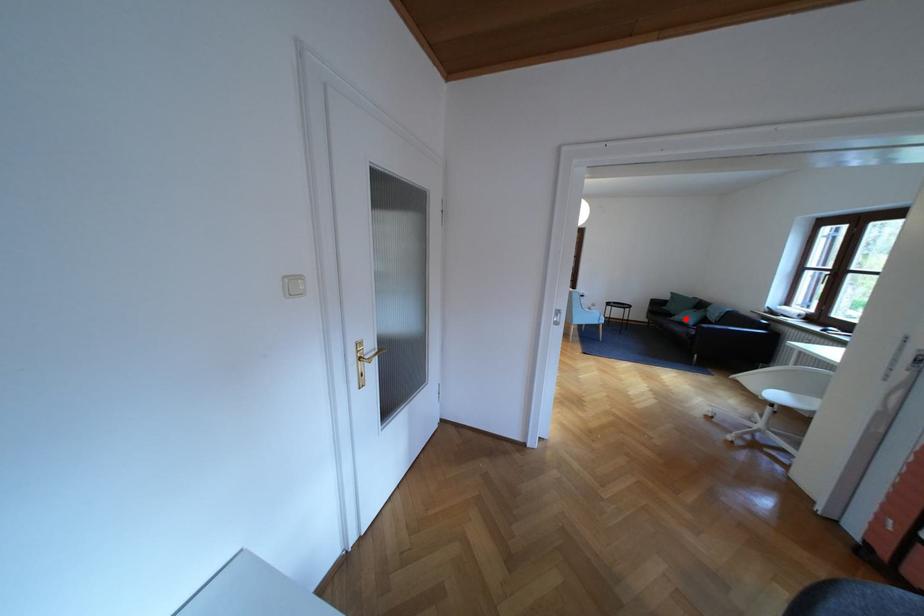
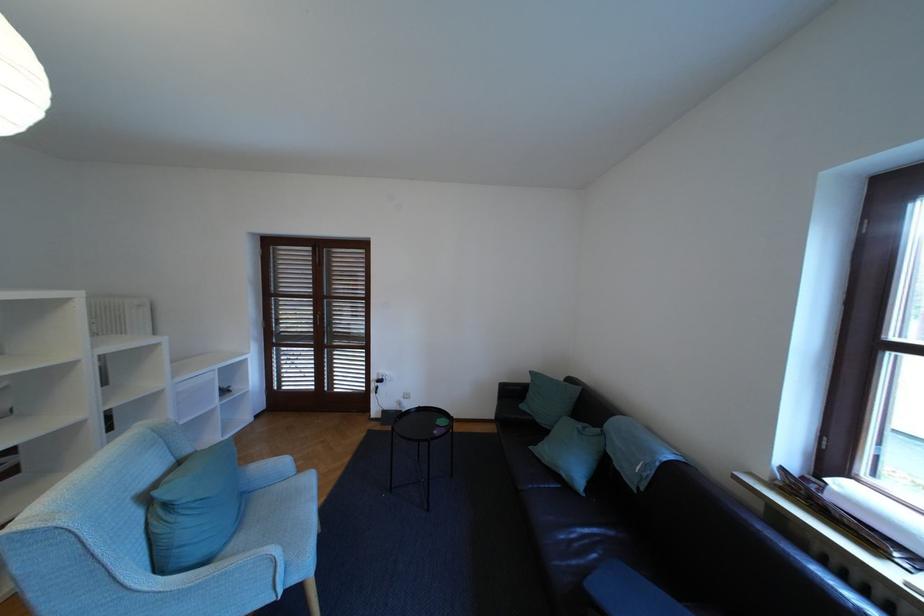
Question: A red point is marked in image1. In image2, is the corresponding 3D point closer to the camera or farther? Reply with the corresponding letter.

Choices:
 (A) The corresponding 3D point is closer.
 (B) The corresponding 3D point is farther.

Answer: (B)